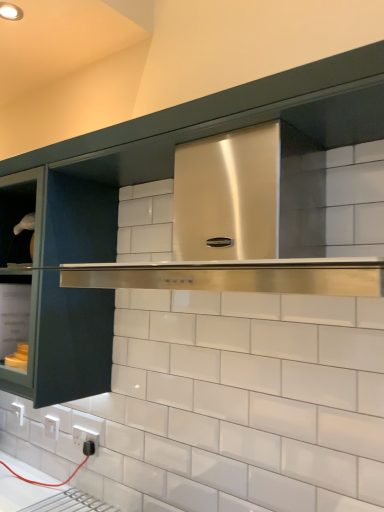
Question: Is black plastic electric outlet at lower left, placed as the first electric outlet when sorted from front to back, to the left or to the right of stainless steel range hood at center in the image?

Choices:
 (A) left
 (B) right

Answer: (A)

Question: In the image, is black plastic electric outlet at lower left, the second electric outlet viewed from the back, positioned in front of or behind stainless steel range hood at center?

Choices:
 (A) front
 (B) behind

Answer: (B)

Question: Estimate the real-world distances between objects in this image. Which object is farther from the white plastic electric outlet at lower left, positioned as the first electric outlet in left-to-right order?

Choices:
 (A) black plastic electric outlet at lower left, placed as the first electric outlet when sorted from front to back
 (B) stainless steel range hood at center
 (C) matte black cabinet door at left

Answer: (B)

Question: Which of these objects is positioned farthest from the stainless steel range hood at center?

Choices:
 (A) matte black cabinet door at left
 (B) black plastic electric outlet at lower left, the first electric outlet in the right-to-left sequence
 (C) white plastic electric outlet at lower left, which is the 2th electric outlet in front-to-back order

Answer: (C)